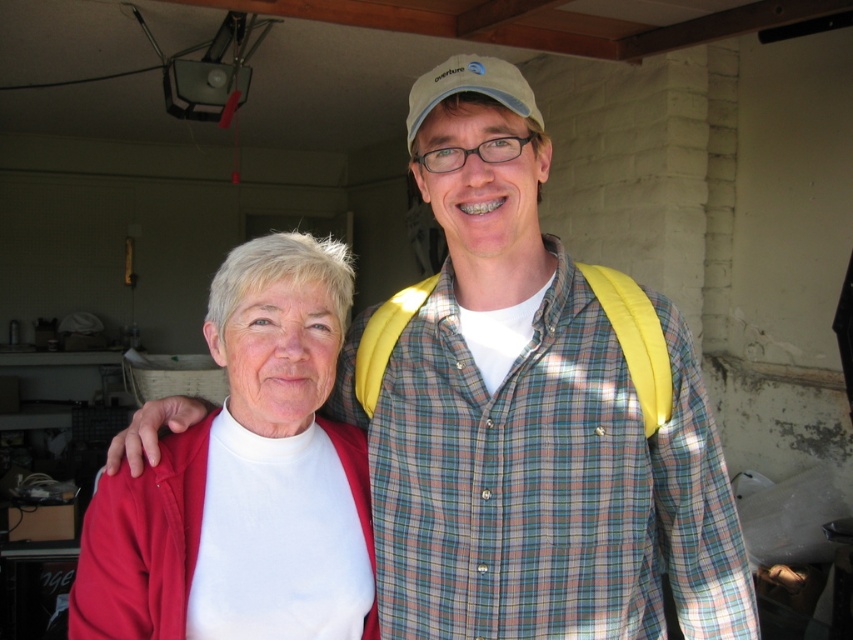
Question: Does yellow fabric backpack at center come behind matte white turtleneck at center?

Choices:
 (A) yes
 (B) no

Answer: (B)

Question: Which point is closer to the camera?

Choices:
 (A) (526, 465)
 (B) (199, 529)

Answer: (B)

Question: Is the position of yellow fabric backpack at center less distant than that of matte white turtleneck at center?

Choices:
 (A) yes
 (B) no

Answer: (A)

Question: In this image, where is yellow fabric backpack at center located relative to matte white turtleneck at center?

Choices:
 (A) left
 (B) right

Answer: (B)